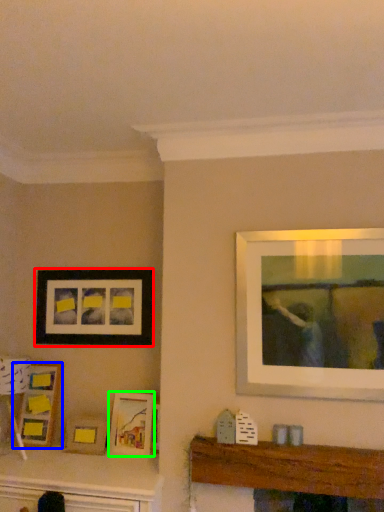
Question: Which object is the closest to the picture frame (highlighted by a red box)? Choose among these: picture frame (highlighted by a blue box) or picture frame (highlighted by a green box).

Choices:
 (A) picture frame
 (B) picture frame

Answer: (A)